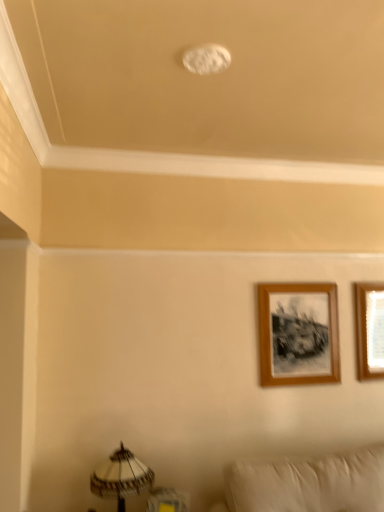
Question: Visually, is wooden frame at upper right, which is counted as the 1th picture frame, starting from the left, positioned to the left or to the right of wooden picture frame at upper right, the first picture frame when ordered from right to left?

Choices:
 (A) left
 (B) right

Answer: (A)

Question: From the image's perspective, is wooden frame at upper right, which is counted as the 1th picture frame, starting from the left, located above or below wooden picture frame at upper right, which is the second picture frame from left to right?

Choices:
 (A) below
 (B) above

Answer: (A)

Question: Which is farther from the white textured lampshade at lower left?

Choices:
 (A) wooden frame at upper right, positioned as the 2th picture frame in right-to-left order
 (B) wooden picture frame at upper right, which is the second picture frame from left to right

Answer: (B)

Question: Which object is the farthest from the wooden picture frame at upper right, which is the second picture frame from left to right?

Choices:
 (A) wooden frame at upper right, positioned as the 2th picture frame in right-to-left order
 (B) white textured lampshade at lower left

Answer: (B)